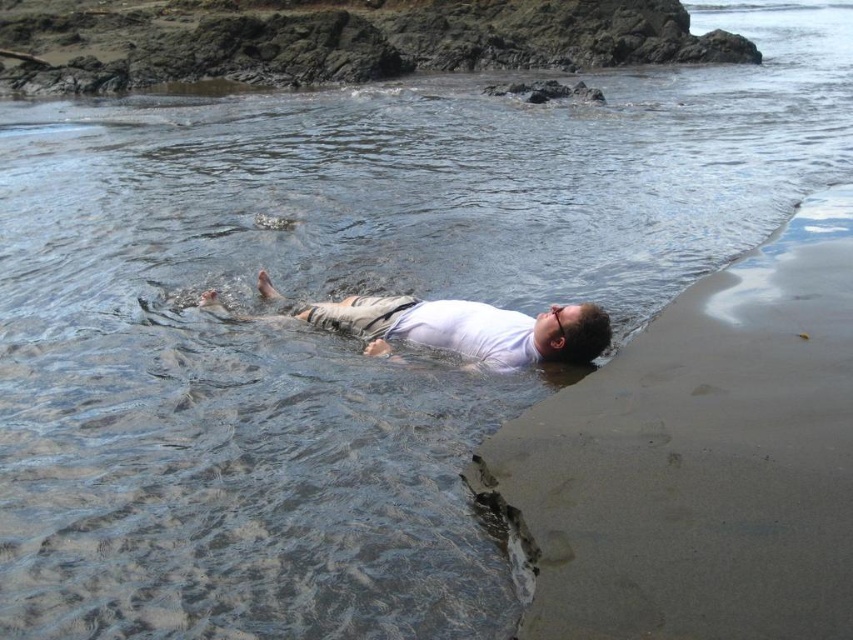
You are standing at the center of the image and want to walk to the sandy shore at lower right. Which direction should you move to reach it?

The sandy shore at lower right is located at coordinates point (699, 460), so you should move towards the lower right direction to reach it.

In the scene shown: You are standing on the sandy shore at lower right and want to reach the white matte shirt at center. Which direction should you move to get closer to the shirt?

The sandy shore at lower right is in front of the white matte shirt at center, so you should move backward to get closer to the shirt.